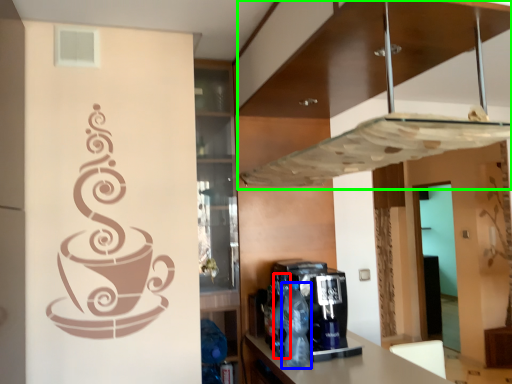
Question: Based on their relative distances, which object is nearer to bottle (highlighted by a red box)? Choose from bottle (highlighted by a blue box) and exhaust hood (highlighted by a green box).

Choices:
 (A) bottle
 (B) exhaust hood

Answer: (A)